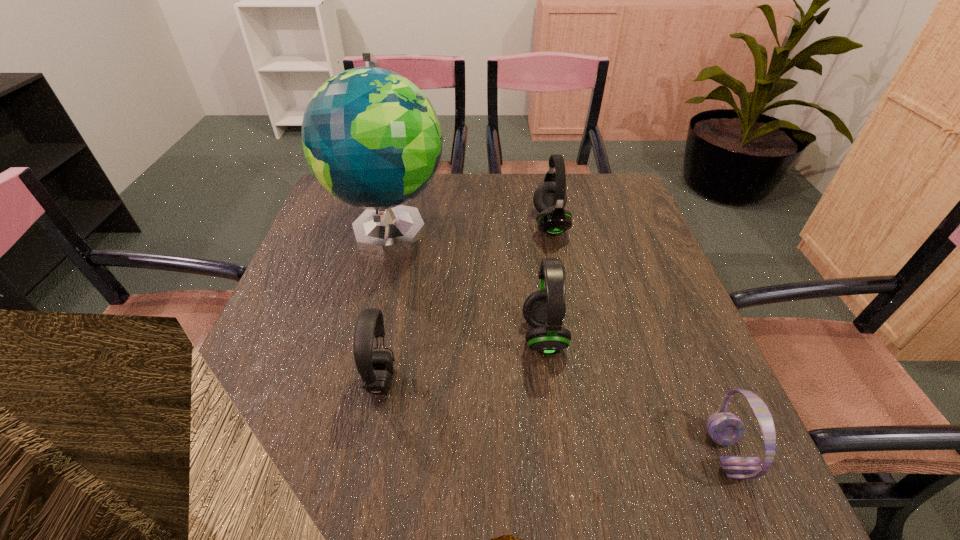
Locate an element on the screen. free space between the farthest headset and the rightmost object is located at coordinates (638, 339).

The image size is (960, 540). I want to click on free area in between the globe and the leftmost headset, so click(x=386, y=304).

Choose which object is the nearest neighbor to the nearest object. Please provide its 2D coordinates. Your answer should be formatted as a tuple, i.e. [(x, y)], where the tuple contains the x and y coordinates of a point satisfying the conditions above.

[(544, 310)]

Identify which object is located as the fourth nearest to the leftmost headset. Please provide its 2D coordinates. Your answer should be formatted as a tuple, i.e. [(x, y)], where the tuple contains the x and y coordinates of a point satisfying the conditions above.

[(726, 429)]

Choose which headset is the nearest neighbor to the leftmost headset. Please provide its 2D coordinates. Your answer should be formatted as a tuple, i.e. [(x, y)], where the tuple contains the x and y coordinates of a point satisfying the conditions above.

[(544, 310)]

The height and width of the screenshot is (540, 960). In order to click on the closest headset to the leftmost headset in this screenshot , I will do `click(544, 310)`.

This screenshot has width=960, height=540. I want to click on free space that satisfies the following two spatial constraints: 1. on the ear cups of the farthest headset; 2. on the front surface of the globe, so click(551, 228).